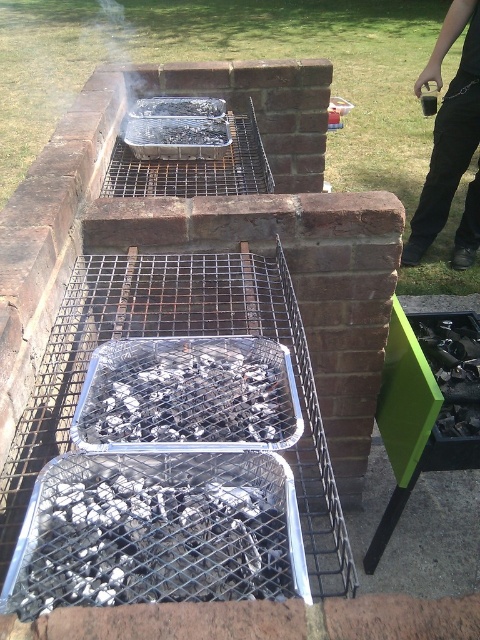
Is point (256, 522) positioned behind point (170, 371)?

No, it is in front of (170, 371).

Does charcoal ash at lower center appear on the right side of charcoal ash at center?

Incorrect, charcoal ash at lower center is not on the right side of charcoal ash at center.

Does point (272, 531) lie behind point (190, 410)?

No, (272, 531) is closer to viewer.

Locate an element on the screen. The height and width of the screenshot is (640, 480). charcoal ash at lower center is located at coordinates (152, 536).

Does black pants at right lie in front of charcoal briquettes at center?

No.

Image resolution: width=480 pixels, height=640 pixels. What do you see at coordinates (447, 128) in the screenshot? I see `black pants at right` at bounding box center [447, 128].

Which is in front, point (441, 113) or point (164, 134)?

Point (164, 134)

You are a GUI agent. You are given a task and a screenshot of the screen. Output one action in this format:
    pyautogui.click(x=<x>, y=<y>)
    Task: Click on the black pants at right
    
    Given the screenshot: What is the action you would take?
    pyautogui.click(x=447, y=128)

Is charcoal ash at lower center below charcoal briquettes at center?

Indeed, charcoal ash at lower center is positioned under charcoal briquettes at center.

Which is more to the left, charcoal ash at lower center or charcoal briquettes at center?

From the viewer's perspective, charcoal briquettes at center appears more on the left side.

Does point (123, 497) come closer to viewer compared to point (180, 134)?

Yes.

Locate an element on the screen. charcoal ash at lower center is located at coordinates (152, 536).